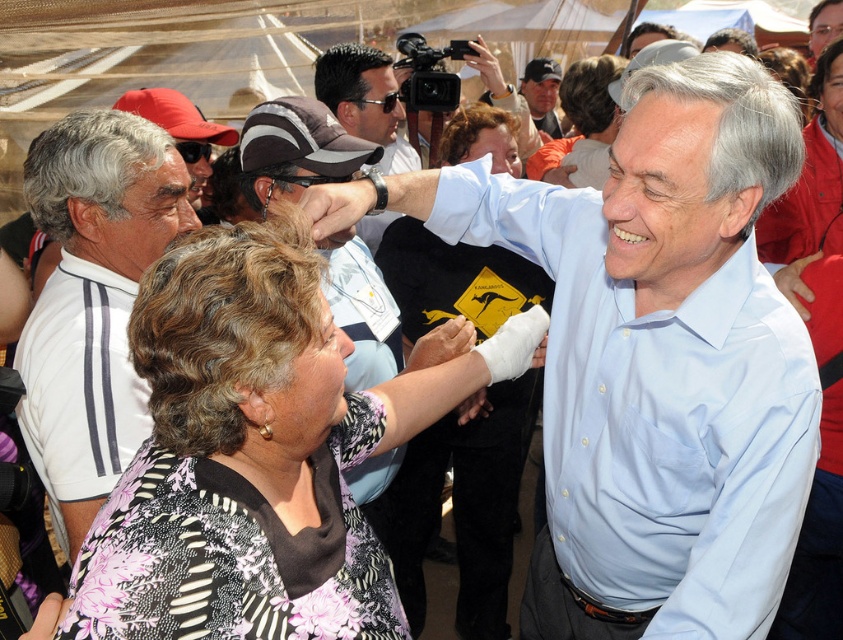
Question: Which point is farther to the camera?

Choices:
 (A) white adidas polo shirt at left
 (B) matte black cap at upper center
 (C) floral-patterned blouse at center
 (D) matte gray cap at center

Answer: (B)

Question: Is light blue shirt at center wider than matte gray cap at center?

Choices:
 (A) yes
 (B) no

Answer: (A)

Question: Which of the following is the farthest from the observer?

Choices:
 (A) (282, 451)
 (B) (535, 106)
 (C) (74, 275)
 (D) (565, 349)

Answer: (B)

Question: Which point is farther from the camera taking this photo?

Choices:
 (A) click(x=78, y=381)
 (B) click(x=551, y=100)

Answer: (B)

Question: Is floral-patterned blouse at center wider than white adidas polo shirt at left?

Choices:
 (A) yes
 (B) no

Answer: (A)

Question: Is floral-patterned blouse at center positioned before matte black cap at upper center?

Choices:
 (A) no
 (B) yes

Answer: (B)